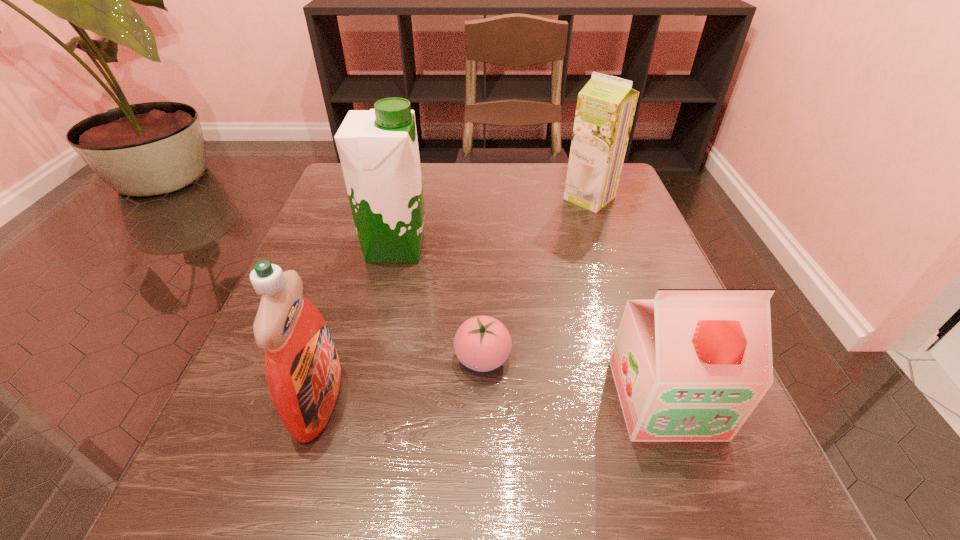
Locate an element on the screen. This screenshot has height=540, width=960. free space between the shortest object and the second nearest soya milk is located at coordinates (439, 303).

The image size is (960, 540). What are the coordinates of `unoccupied area between the second nearest soya milk and the nearest soya milk` in the screenshot? It's located at (530, 322).

Identify the location of free space between the second farthest object and the farthest object. This screenshot has height=540, width=960. (492, 222).

At what (x,y) coordinates should I click in order to perform the action: click on object that is the third closest to the fourth nearest object. Please return your answer as a coordinate pair (x, y). Looking at the image, I should click on (606, 105).

This screenshot has height=540, width=960. I want to click on object that stands as the fourth closest to the third object from right to left, so click(x=606, y=105).

Where is `the closest soya milk relative to the tomato`? the closest soya milk relative to the tomato is located at coordinates (691, 365).

Find the location of a particular element. The image size is (960, 540). soya milk that stands as the third closest to the tomato is located at coordinates (606, 105).

Image resolution: width=960 pixels, height=540 pixels. I want to click on vacant space that satisfies the following two spatial constraints: 1. on the front-facing side of the shortest object; 2. on the right side of the second farthest object, so click(x=370, y=359).

Where is `free space that satisfies the following two spatial constraints: 1. on the front-facing side of the third object from left to right; 2. on the left side of the second nearest soya milk`? The width and height of the screenshot is (960, 540). free space that satisfies the following two spatial constraints: 1. on the front-facing side of the third object from left to right; 2. on the left side of the second nearest soya milk is located at coordinates (370, 359).